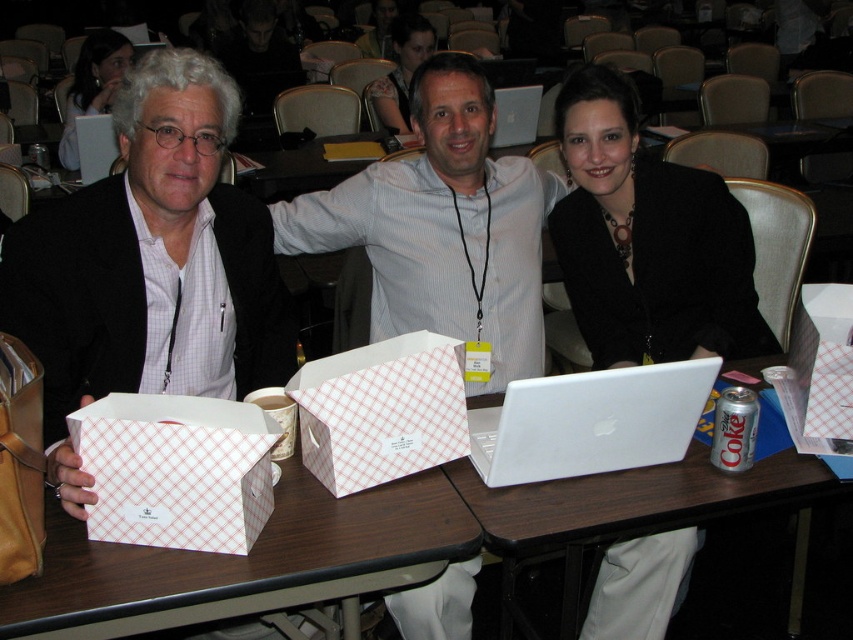
Who is more forward, (222, 384) or (494, 276)?

Point (222, 384) is in front.

Between matte white box at left and white checkered box at center, which one appears on the left side from the viewer's perspective?

Positioned to the left is matte white box at left.

At what (x,y) coordinates should I click in order to perform the action: click on matte white box at left. Please return your answer as a coordinate pair (x, y). Looking at the image, I should click on (149, 266).

From the picture: Can you confirm if white paper bag at center is smaller than silver metallic laptop at center?

No, white paper bag at center is not smaller than silver metallic laptop at center.

Is white paper bag at center closer to camera compared to silver metallic laptop at center?

That is True.

Is point (204, 572) in front of point (495, 138)?

That is True.

Find the location of a particular element. This screenshot has height=640, width=853. white paper bag at center is located at coordinates (245, 563).

Does white paper bag at center appear under white matte laptop at center?

Indeed, white paper bag at center is positioned under white matte laptop at center.

Locate an element on the screen. white paper bag at center is located at coordinates pos(245,563).